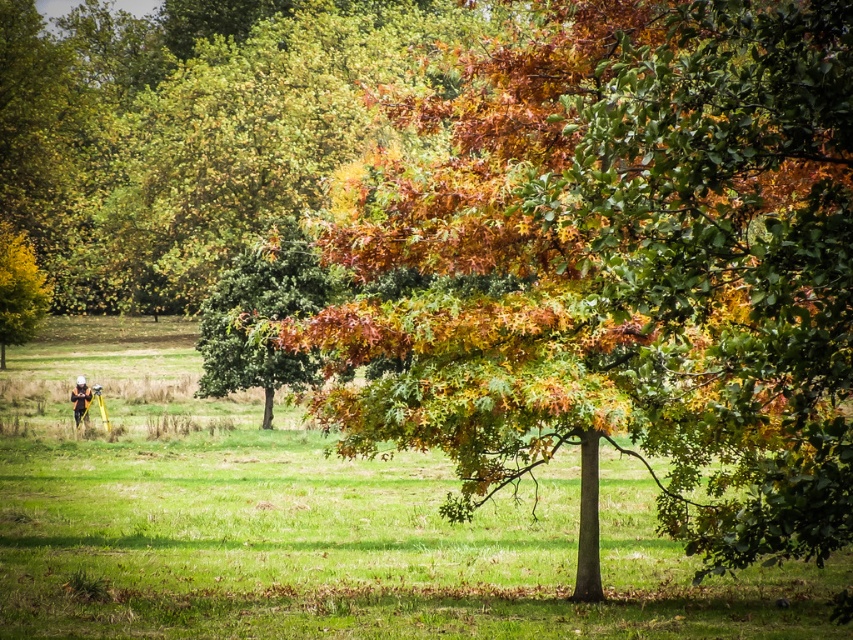
You are standing in the autumnal landscape and want to take a photo of the multicolored foliage at center and the green leafy tree at center. Which object is located above the other in the scene?

The multicolored foliage at center is positioned over the green leafy tree at center, meaning it is above the tree in the scene.